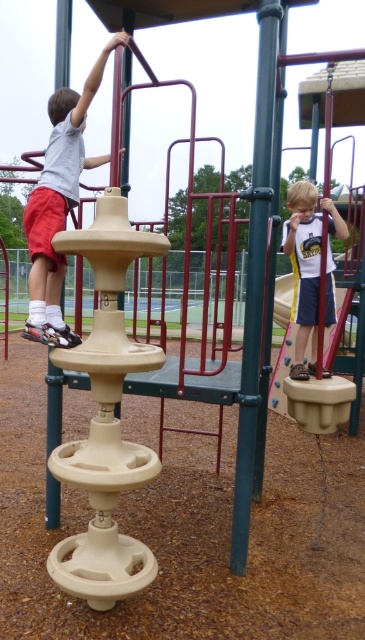
Can you confirm if matte beige climbing structure at left is positioned to the left of beige plastic swing at right?

Indeed, matte beige climbing structure at left is positioned on the left side of beige plastic swing at right.

Does matte beige climbing structure at left appear under beige plastic swing at right?

Incorrect, matte beige climbing structure at left is not positioned below beige plastic swing at right.

This screenshot has width=365, height=640. Find the location of `matte beige climbing structure at left`. matte beige climbing structure at left is located at coordinates (59, 204).

Who is higher up, matte white shirt at lower right or beige plastic swing at right?

matte white shirt at lower right is above.

Between matte white shirt at lower right and beige plastic swing at right, which one is positioned lower?

beige plastic swing at right is lower down.

At what (x,y) coordinates should I click in order to perform the action: click on matte white shirt at lower right. Please return your answer as a coordinate pair (x, y). Image resolution: width=365 pixels, height=640 pixels. Looking at the image, I should click on (304, 269).

Is matte beige climbing structure at left below matte white shirt at lower right?

No.

Does matte beige climbing structure at left have a lesser height compared to matte white shirt at lower right?

Incorrect, matte beige climbing structure at left's height does not fall short of matte white shirt at lower right's.

Does point (52, 150) lie in front of point (305, 248)?

Yes, it is.

Locate an element on the screen. The image size is (365, 640). matte beige climbing structure at left is located at coordinates (59, 204).